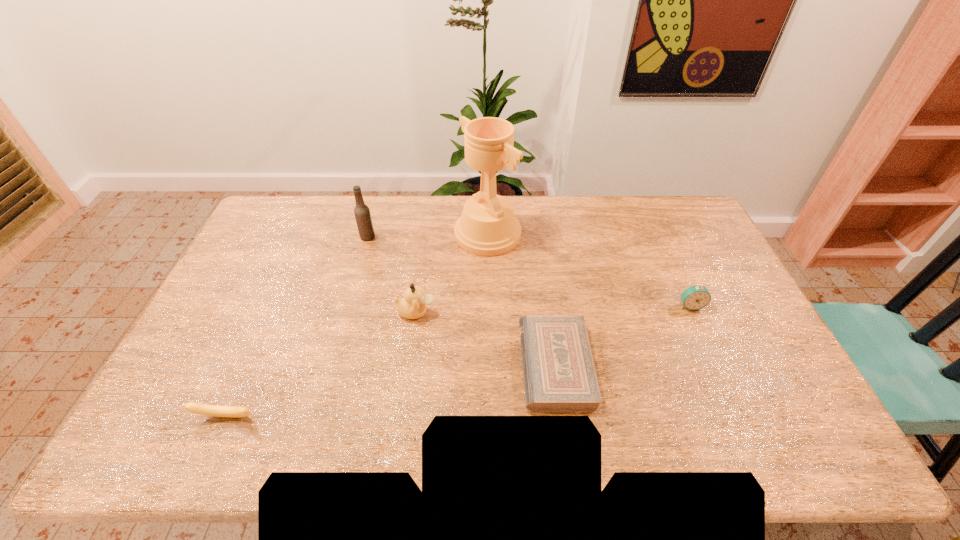
This screenshot has height=540, width=960. I want to click on vacant space located 0.260m on the front of the award, so (x=490, y=316).

The width and height of the screenshot is (960, 540). Find the location of `vacant space located 0.210m on the label of the fifth shortest object`. vacant space located 0.210m on the label of the fifth shortest object is located at coordinates (434, 237).

Locate an element on the screen. The image size is (960, 540). vacant space located 0.400m on the face of the fourth object from right to left is located at coordinates (568, 312).

Locate an element on the screen. This screenshot has width=960, height=540. vacant region located on the front-facing side of the alarm clock is located at coordinates (720, 372).

Identify the location of free spot located 0.140m on the spine side of the shortest object. This screenshot has height=540, width=960. (469, 364).

Where is `free spot located 0.240m on the spine side of the shortest object`? free spot located 0.240m on the spine side of the shortest object is located at coordinates (432, 364).

Identify the location of blank space located on the spine side of the shortest object. The height and width of the screenshot is (540, 960). (477, 364).

This screenshot has height=540, width=960. What are the coordinates of `award present at the far edge` in the screenshot? It's located at (487, 227).

This screenshot has width=960, height=540. What are the coordinates of `beer bottle that is at the far edge` in the screenshot? It's located at (362, 213).

The height and width of the screenshot is (540, 960). I want to click on object that is at the left edge, so click(198, 408).